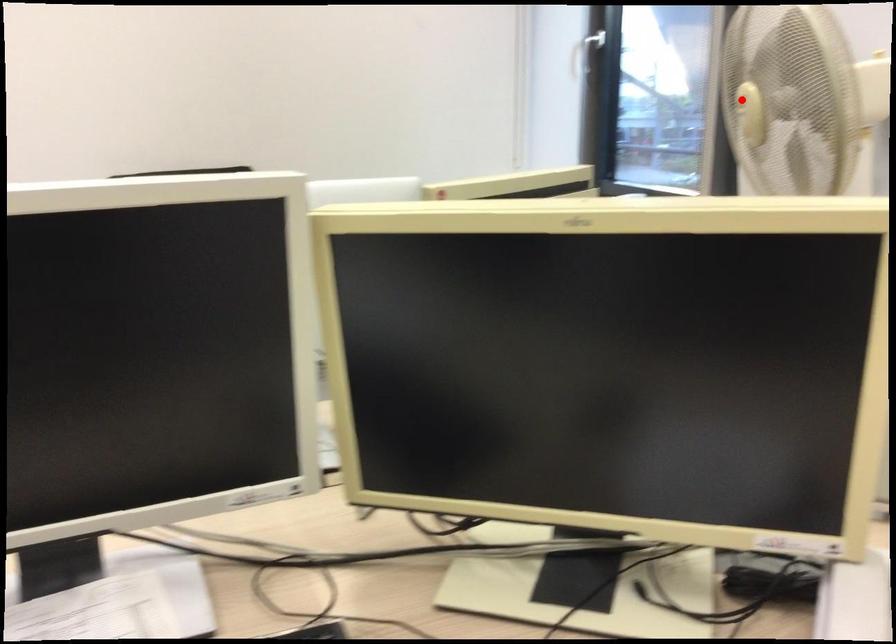
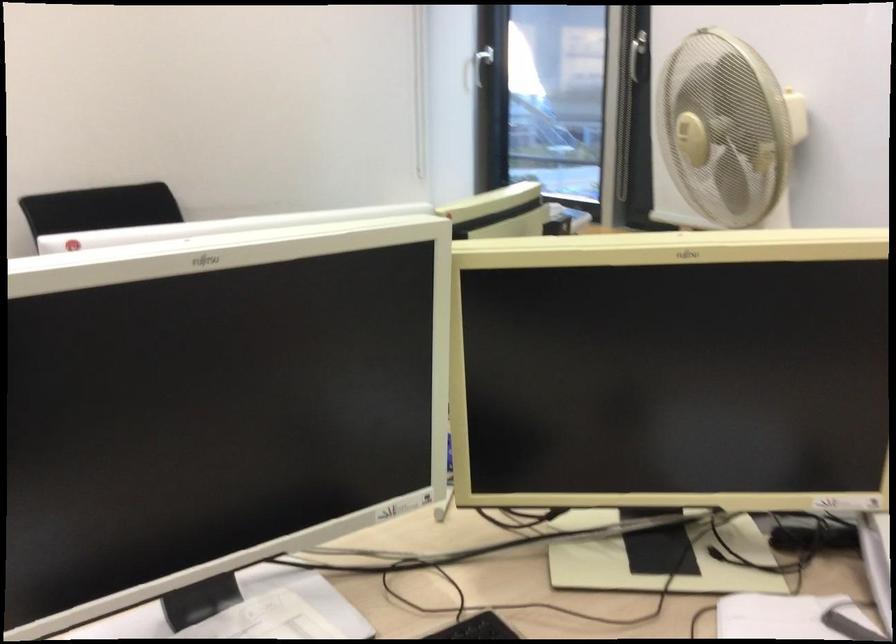
Locate, in the second image, the point that corresponds to the highlighted location in the first image.

(685, 129)